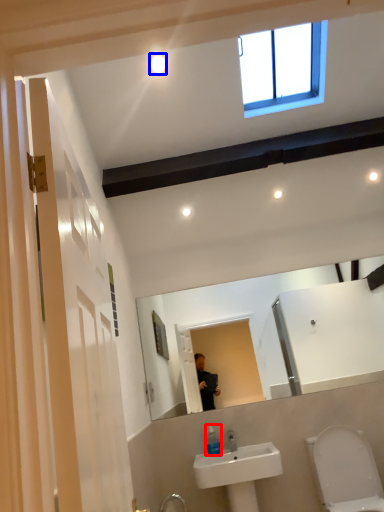
Question: Which of the following is the farthest to the observer, soap dispenser (highlighted by a red box) or lighting (highlighted by a blue box)?

Choices:
 (A) soap dispenser
 (B) lighting

Answer: (A)